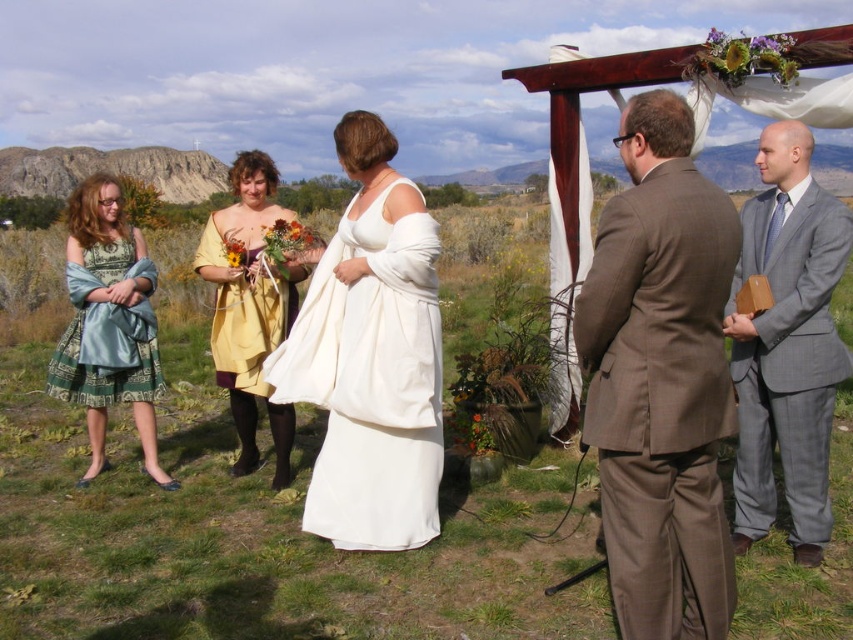
Question: Which of the following is the closest to the observer?

Choices:
 (A) (67, 380)
 (B) (392, 404)
 (C) (61, 339)
 (D) (251, 177)

Answer: (B)

Question: Can you confirm if yellow satin dress at center is smaller than silky teal dress at left?

Choices:
 (A) yes
 (B) no

Answer: (B)

Question: Which object is the closest to the white satin dress at center?

Choices:
 (A) gray suit at right
 (B) brown wool suit at center
 (C) yellow satin dress at center
 (D) matte yellow dress at center

Answer: (D)

Question: Which of the following is the farthest from the observer?

Choices:
 (A) gray suit at right
 (B) brown wool suit at center
 (C) green satin dress at left
 (D) yellow satin dress at center

Answer: (C)

Question: Is brown wool suit at center bigger than yellow satin dress at center?

Choices:
 (A) yes
 (B) no

Answer: (A)

Question: Can you confirm if brown wool suit at center is positioned to the right of white satin dress at center?

Choices:
 (A) yes
 (B) no

Answer: (A)